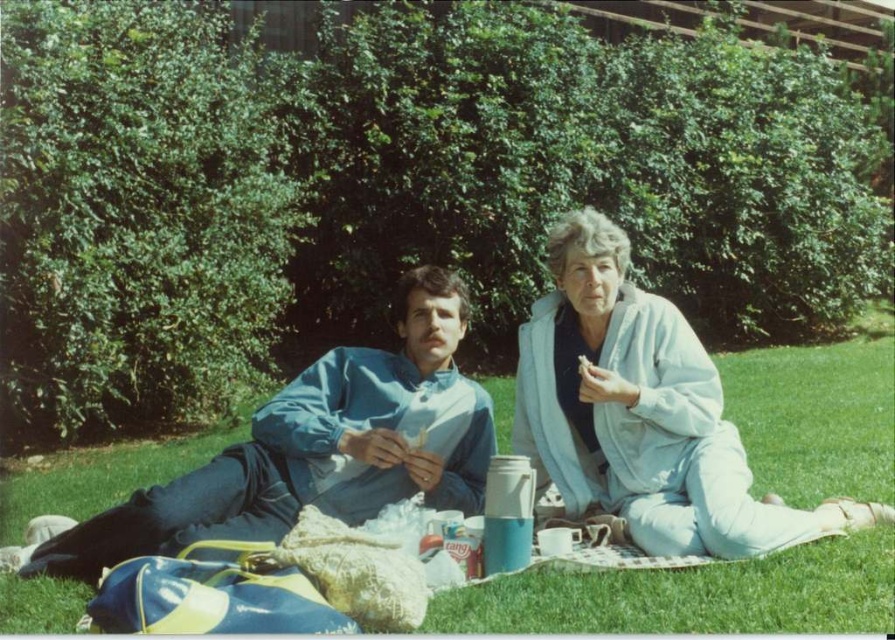
You are standing at the camera position and want to throw a frisbee to your friend who is at point (478, 444). There is an obstacle at point (603, 250). Will the frisbee hit the obstacle before reaching your friend?

Point (603, 250) is closer to the camera than point (478, 444). Therefore, the frisbee thrown from the camera position to your friend at (478, 444) will pass by the obstacle at (603, 250) first, so it will hit the obstacle before reaching your friend.

You are a photographer trying to capture the scene from above. You notice the green grass at center and the light blue fabric pants at lower right. Which object is positioned lower in the image?

The light blue fabric pants at lower right are positioned lower in the image than the green grass at center.

You are planning to place a small picnic basket between the green grass at center and the blue fabric jacket at center. Based on their positions, which object should the basket be closer to?

The green grass at center is to the right of the blue fabric jacket at center, so the picnic basket should be placed closer to the blue fabric jacket at center to be between them.